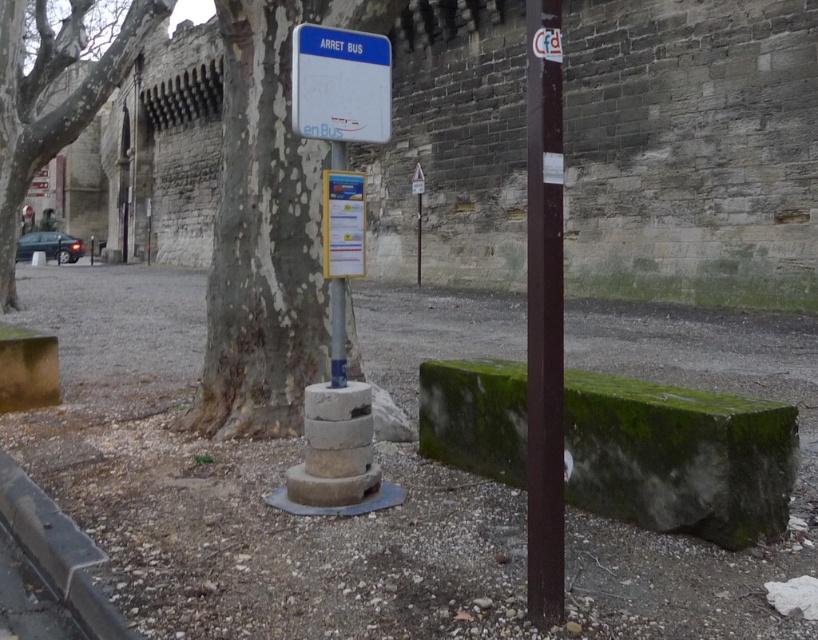
Question: Which point is farther to the camera?

Choices:
 (A) (385, 96)
 (B) (333, 332)
 (C) (19, 42)

Answer: (C)

Question: Is smooth gray bark at left wider than metallic signpost at center?

Choices:
 (A) yes
 (B) no

Answer: (A)

Question: Can you confirm if brown polished wood pole at right is positioned below metallic signpost at center?

Choices:
 (A) yes
 (B) no

Answer: (B)

Question: Is brown polished wood pole at right positioned before smooth gray bark at left?

Choices:
 (A) no
 (B) yes

Answer: (B)

Question: Which point is closer to the camera?

Choices:
 (A) pos(538,500)
 (B) pos(12,124)

Answer: (A)

Question: Which point appears farthest from the camera in this image?

Choices:
 (A) (536, 420)
 (B) (93, 8)
 (C) (366, 68)

Answer: (B)